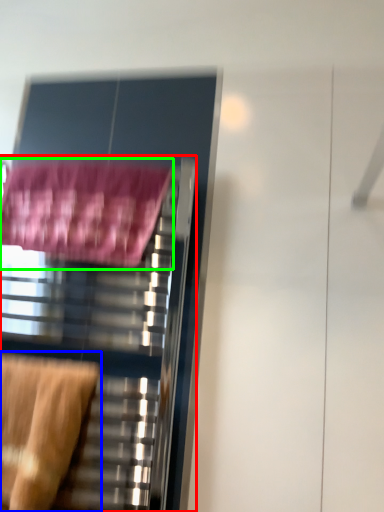
Question: Which object is positioned farthest from furniture (highlighted by a red box)? Select from swivel chair (highlighted by a blue box) and bath towel (highlighted by a green box).

Choices:
 (A) swivel chair
 (B) bath towel

Answer: (B)